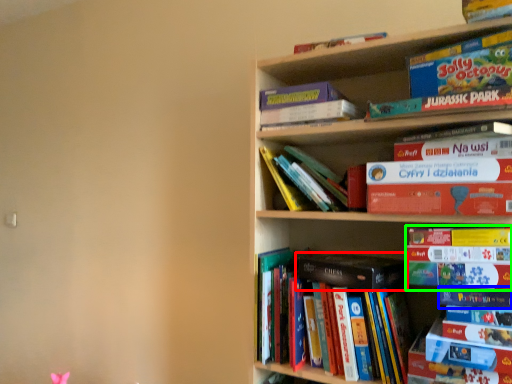
Question: Estimate the real-world distances between objects in this image. Which object is farther from paperback book (highlighted by a red box), book (highlighted by a blue box) or book (highlighted by a green box)?

Choices:
 (A) book
 (B) book

Answer: (A)